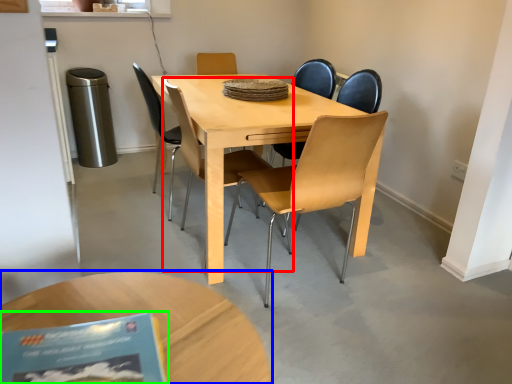
Question: Which object is positioned farthest from chair (highlighted by a red box)? Select from coffee table (highlighted by a blue box) and book (highlighted by a green box).

Choices:
 (A) coffee table
 (B) book

Answer: (B)